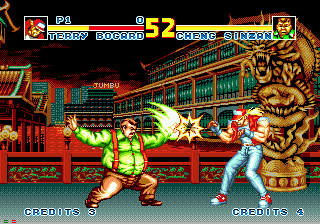
Locate an element on the screen. floor is located at coordinates (184, 208).